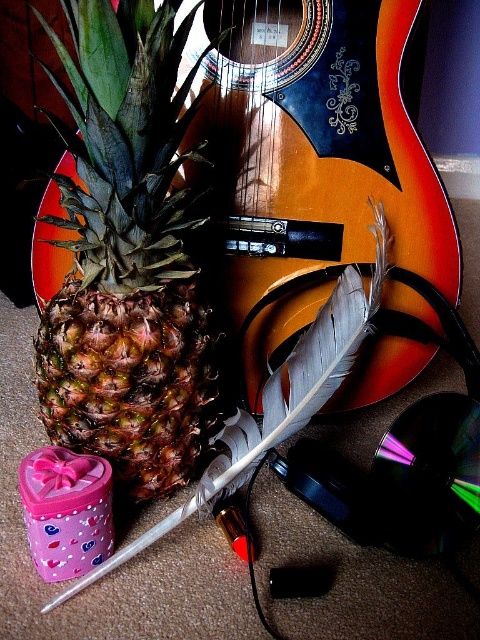
Based on the photo, you are a delivery robot with a 10 inch wide tray. You need to place a small package between the glossy wood guitar at upper center and the brown rough pineapple at center. Can you fit the package there?

The glossy wood guitar at upper center and brown rough pineapple at center are 8.73 inches apart from each other. Since the package requires a space of at least 10 inches to fit, it cannot be placed between them.

You are a photographer standing at the camera position. You want to take a closeup shot of the glossy wood guitar at upper center. If your camera can focus on objects within 30 inches, will you need to move closer or farther away?

The distance between the glossy wood guitar at upper center and the camera is 35.40 inches. Since the camera can focus within 30 inches, you need to move closer to the glossy wood guitar at upper center to get a closeup shot.